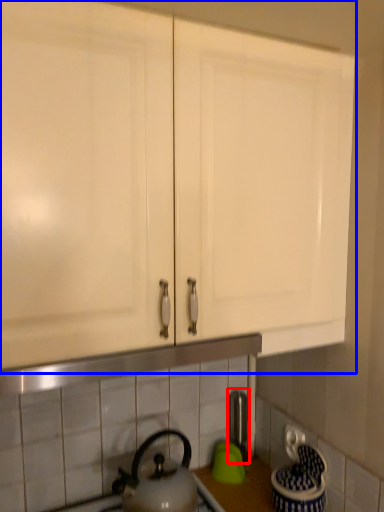
Question: Among these objects, which one is farthest to the camera, faucet (highlighted by a red box) or cabinetry (highlighted by a blue box)?

Choices:
 (A) faucet
 (B) cabinetry

Answer: (A)